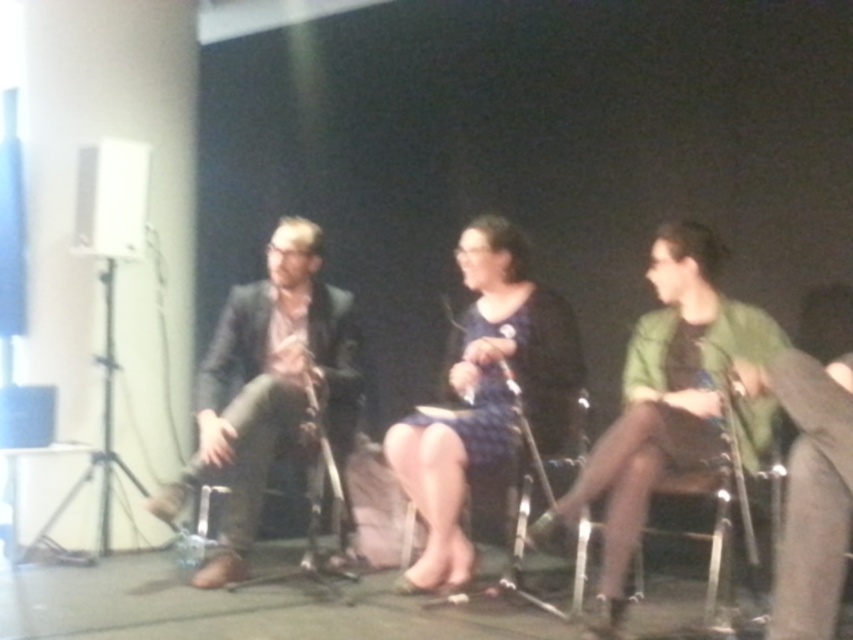
Question: Which object is positioned farthest from the blue textured dress at center?

Choices:
 (A) metallic silver chair at center
 (B) wooden chair at center

Answer: (A)

Question: Is dark brown leather jacket at left below wooden chair at center?

Choices:
 (A) yes
 (B) no

Answer: (B)

Question: Which point appears closest to the camera in this image?

Choices:
 (A) (544, 474)
 (B) (679, 417)
 (C) (410, 417)

Answer: (B)

Question: Estimate the real-world distances between objects in this image. Which object is farther from the blue textured dress at center?

Choices:
 (A) green matte jacket at center
 (B) dark brown leather jacket at left
 (C) wooden chair at center
 (D) metallic silver chair at center

Answer: (B)

Question: Is green matte jacket at center below metallic silver chair at center?

Choices:
 (A) no
 (B) yes

Answer: (A)

Question: Does blue textured dress at center appear on the right side of wooden chair at center?

Choices:
 (A) no
 (B) yes

Answer: (A)